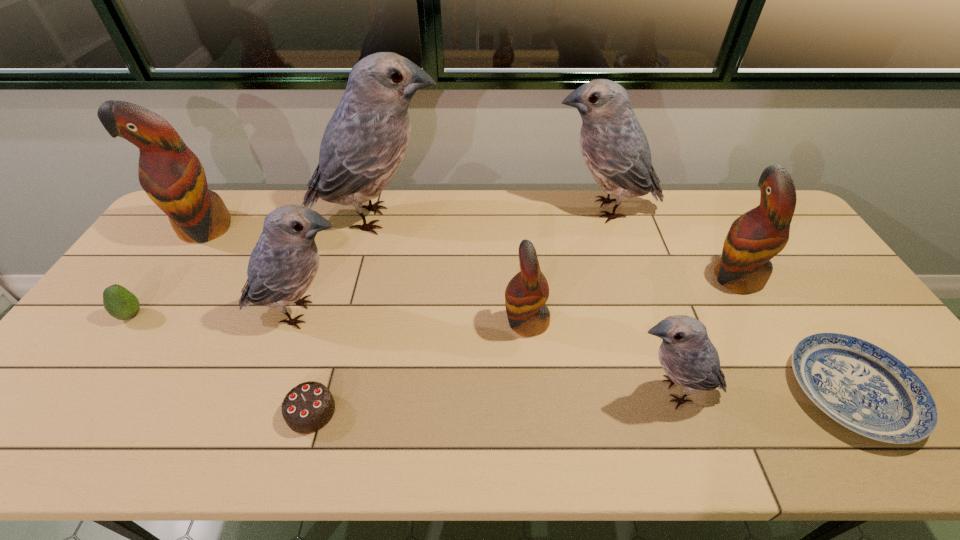
Where is `vacant space situated 0.060m on the face of the second red parrot from right to left`? The width and height of the screenshot is (960, 540). vacant space situated 0.060m on the face of the second red parrot from right to left is located at coordinates (481, 322).

Find the location of a particular element. vacant area situated on the face of the second red parrot from right to left is located at coordinates (374, 322).

This screenshot has height=540, width=960. I want to click on free region located on the face of the second red parrot from right to left, so click(x=393, y=322).

The image size is (960, 540). I want to click on blank area located on the back of the avocado, so click(193, 228).

Locate an element on the screen. The height and width of the screenshot is (540, 960). free region located 0.240m on the back of the second shortest object is located at coordinates (340, 313).

The width and height of the screenshot is (960, 540). I want to click on vacant space located on the back of the plate, so click(x=798, y=310).

I want to click on chocolate cake located at the near edge, so point(308,407).

The height and width of the screenshot is (540, 960). In order to click on plate present at the near edge in this screenshot , I will do `click(861, 386)`.

The width and height of the screenshot is (960, 540). What are the coordinates of `parrot at the left edge` in the screenshot? It's located at point(173,177).

This screenshot has height=540, width=960. What are the coordinates of `avocado located at the left edge` in the screenshot? It's located at (120, 303).